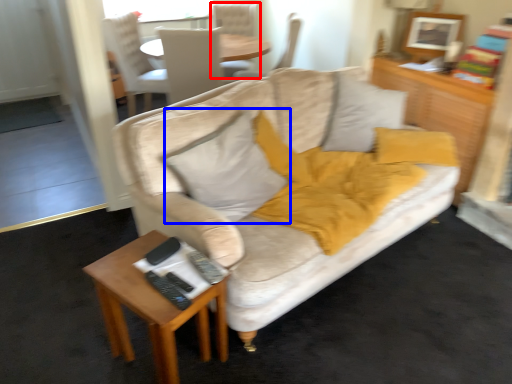
Question: Which point is further to the camera, chair (highlighted by a red box) or pillow (highlighted by a blue box)?

Choices:
 (A) chair
 (B) pillow

Answer: (A)